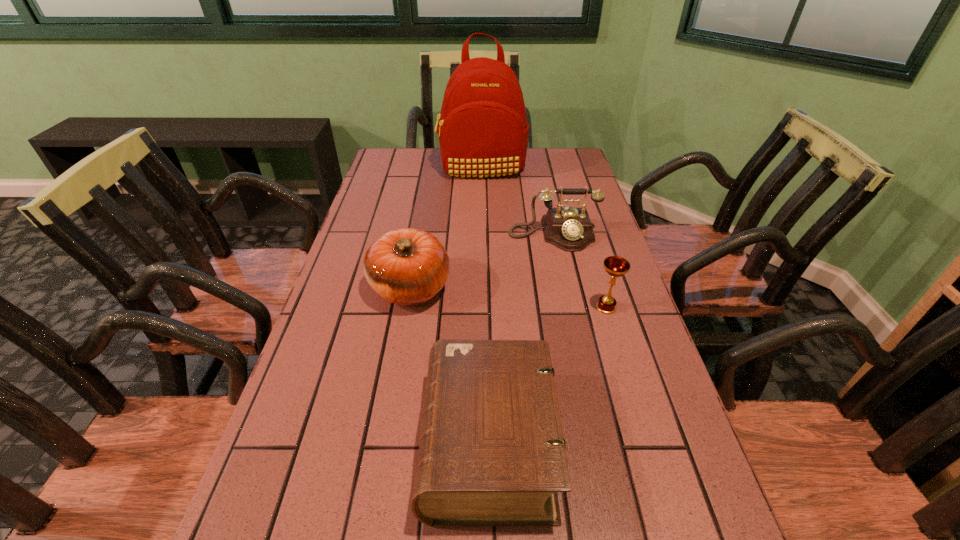
Image resolution: width=960 pixels, height=540 pixels. I want to click on vacant space located on the spine side of the nearest object, so coord(373,442).

The image size is (960, 540). Identify the location of free space located 0.060m on the spine side of the nearest object. (390, 442).

Find the location of a particular element. The image size is (960, 540). free space located 0.260m on the spine side of the nearest object is located at coordinates (276, 442).

You are a GUI agent. You are given a task and a screenshot of the screen. Output one action in this format:
    pyautogui.click(x=<x>, y=<y>)
    Task: Click on the object at the far edge
    This screenshot has width=960, height=540.
    Given the screenshot: What is the action you would take?
    pyautogui.click(x=483, y=131)

At what (x,y) coordinates should I click in order to perform the action: click on object positioned at the left edge. Please return your answer as a coordinate pair (x, y). Image resolution: width=960 pixels, height=540 pixels. Looking at the image, I should click on (407, 266).

This screenshot has width=960, height=540. What are the coordinates of `telephone at the right edge` in the screenshot? It's located at [569, 229].

Where is `chalice that is at the right edge`? The image size is (960, 540). chalice that is at the right edge is located at coordinates (616, 266).

The height and width of the screenshot is (540, 960). I want to click on vacant space at the left edge of the desktop, so click(399, 194).

What are the coordinates of `free space at the right edge of the desktop` in the screenshot? It's located at (612, 350).

The height and width of the screenshot is (540, 960). What are the coordinates of `free point at the far left corner` in the screenshot? It's located at (385, 150).